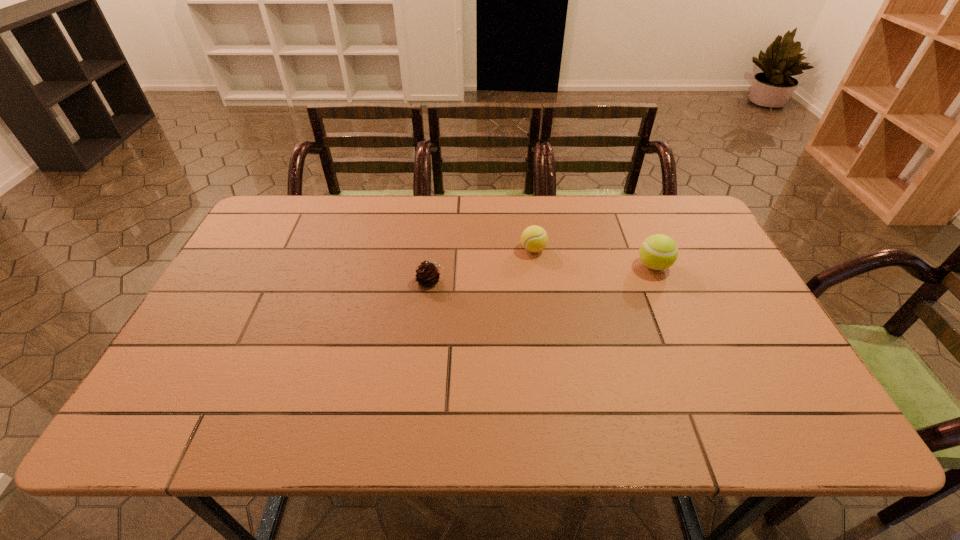
Where is `free region at the left edge of the desktop`? free region at the left edge of the desktop is located at coordinates (282, 248).

Identify the location of vacant space at the right edge. (746, 296).

In the image, there is a desktop. What are the coordinates of `vacant space at the far left corner` in the screenshot? It's located at (276, 197).

Locate an element on the screen. The image size is (960, 540). vacant space at the near left corner of the desktop is located at coordinates (180, 407).

Locate an element on the screen. This screenshot has height=540, width=960. vacant space at the far right corner of the desktop is located at coordinates pos(684,212).

Where is `vacant area between the right tennis ball and the second object from right to left`? Image resolution: width=960 pixels, height=540 pixels. vacant area between the right tennis ball and the second object from right to left is located at coordinates (593, 258).

Locate an element on the screen. Image resolution: width=960 pixels, height=540 pixels. free spot between the right tennis ball and the shorter tennis ball is located at coordinates (593, 258).

The image size is (960, 540). What are the coordinates of `vacant area that lies between the tallest object and the second object from left to right` in the screenshot? It's located at (593, 258).

Image resolution: width=960 pixels, height=540 pixels. Find the location of `free space between the left tennis ball and the right tennis ball`. free space between the left tennis ball and the right tennis ball is located at coordinates click(593, 258).

Find the location of a particular element. This screenshot has width=960, height=540. free space that is in between the shorter tennis ball and the pinecone is located at coordinates (482, 265).